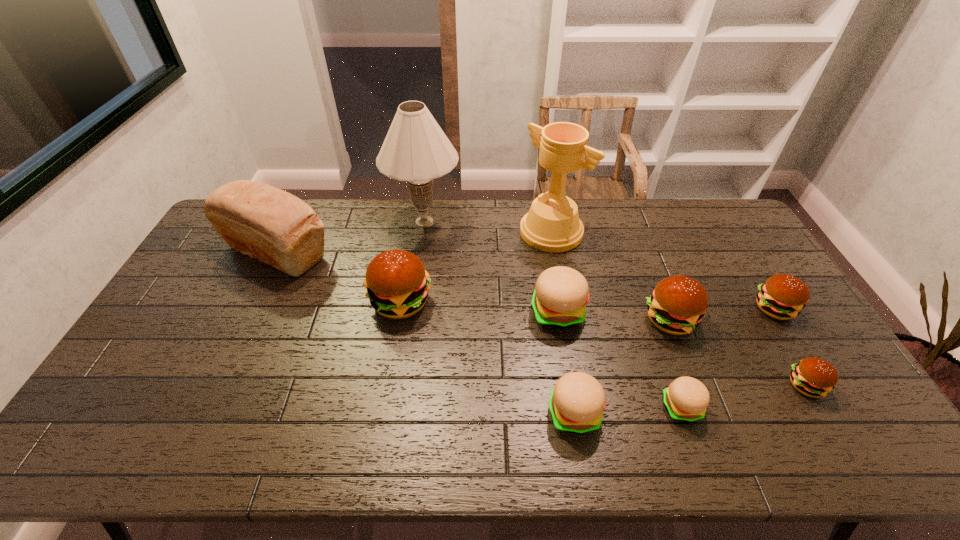
Where is `vacant space situated on the back of the smallest brown hamburger`? This screenshot has width=960, height=540. vacant space situated on the back of the smallest brown hamburger is located at coordinates (764, 315).

Where is `vacant space located on the right of the rightmost beige hamburger`? This screenshot has height=540, width=960. vacant space located on the right of the rightmost beige hamburger is located at coordinates (825, 407).

Locate an element on the screen. The image size is (960, 540). lampshade at the far edge is located at coordinates 416,150.

Locate an element on the screen. This screenshot has width=960, height=540. award at the far edge is located at coordinates (552, 224).

At what (x,y) coordinates should I click in order to perform the action: click on bread that is at the far edge. Please return your answer as a coordinate pair (x, y). The height and width of the screenshot is (540, 960). Looking at the image, I should click on (261, 221).

I want to click on object located at the left edge, so click(x=261, y=221).

Where is `object present at the far left corner`? object present at the far left corner is located at coordinates (261, 221).

Image resolution: width=960 pixels, height=540 pixels. Identify the location of blank space at the far edge. (622, 221).

What are the coordinates of `vacant space at the near edge of the desktop` in the screenshot? It's located at (691, 448).

Where is `free region at the left edge`? This screenshot has height=540, width=960. free region at the left edge is located at coordinates (112, 415).